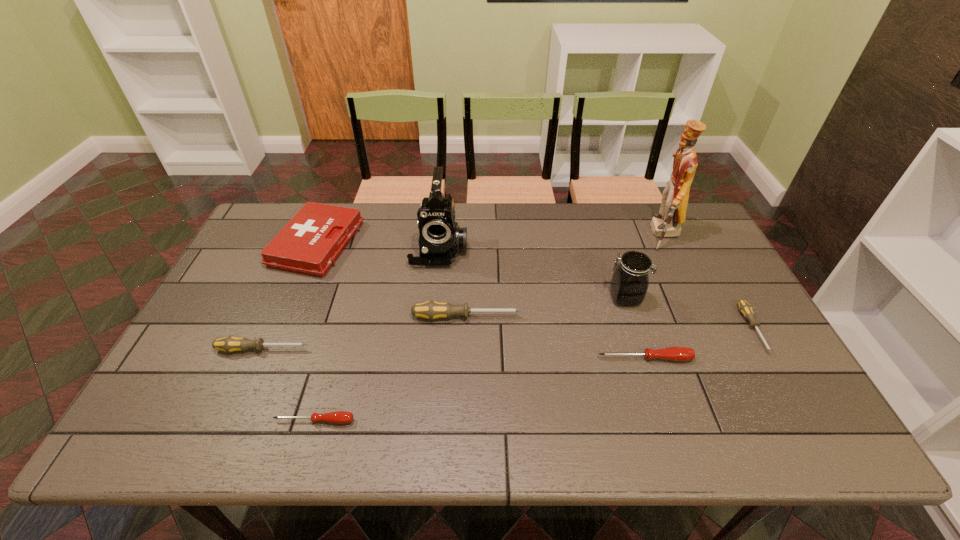
Identify the location of vacant region located on the lid of the jar. (551, 298).

Find the location of a particular element. The height and width of the screenshot is (540, 960). free space located 0.230m on the right of the red first-aid kit is located at coordinates (429, 244).

Image resolution: width=960 pixels, height=540 pixels. What are the coordinates of `free region located at the tip of the tallest screwdriver` in the screenshot? It's located at (564, 317).

The width and height of the screenshot is (960, 540). Identify the location of vacant position located 0.370m at the tip of the second biggest gray screwdriver. (453, 349).

This screenshot has height=540, width=960. Identify the location of vacant space located 0.110m on the right of the right red screwdriver. (735, 359).

Find the location of a particular element. free space located 0.200m at the tip of the rightmost gray screwdriver is located at coordinates (810, 431).

Where is `free point located 0.080m on the back of the smaller red screwdriver`? This screenshot has width=960, height=540. free point located 0.080m on the back of the smaller red screwdriver is located at coordinates (325, 384).

At what (x,y) coordinates should I click in order to perform the action: click on nutcracker that is positioned at the far edge. Please return your answer as a coordinate pair (x, y). Looking at the image, I should click on (667, 223).

This screenshot has width=960, height=540. I want to click on camcorder located at the far edge, so (440, 238).

Identify the location of the first-aid kit at the far edge. The width and height of the screenshot is (960, 540). (310, 243).